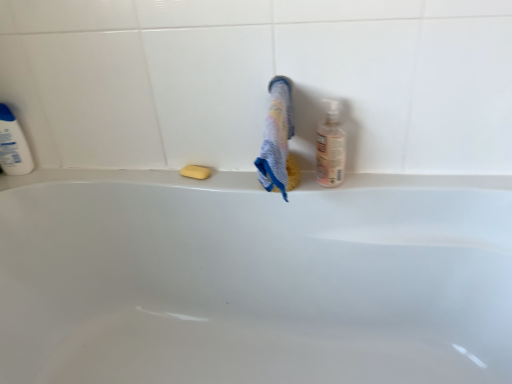
This screenshot has height=384, width=512. I want to click on empty space that is in between white plastic bottle at left, the 2th cleaning product in the right-to-left sequence, and yellow matte soap at center, so click(x=111, y=169).